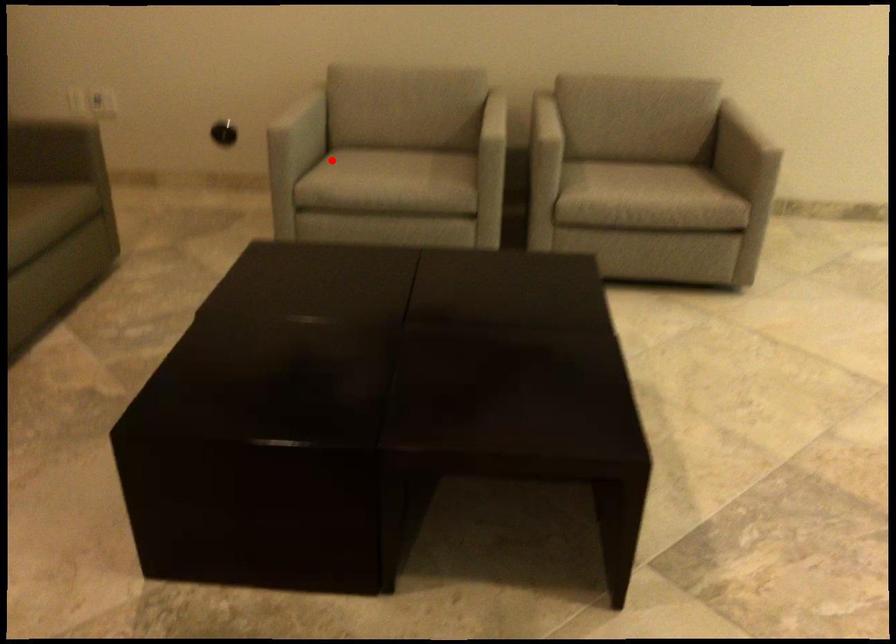
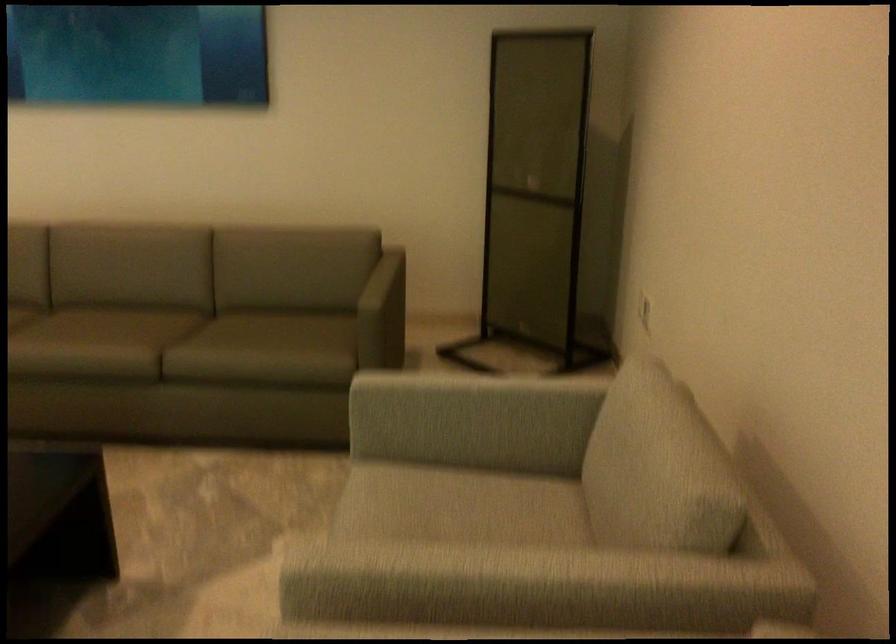
Question: I am providing you with two images of the same scene from different viewpoints. Image1 has a red point marked. In image2, the corresponding 3D location appears at what relative position? Reply with the corresponding letter.

Choices:
 (A) Closer
 (B) Farther

Answer: (A)